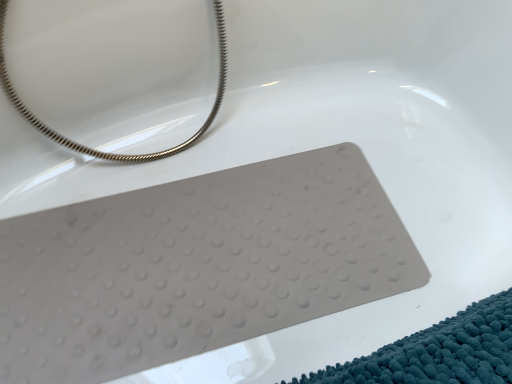
What do you see at coordinates (113, 153) in the screenshot? The width and height of the screenshot is (512, 384). I see `silver metallic chain at upper left` at bounding box center [113, 153].

Find the location of `silver metallic chain at upper left`. silver metallic chain at upper left is located at coordinates point(113,153).

Find the location of a particular element. This screenshot has width=512, height=384. silver metallic chain at upper left is located at coordinates (x=113, y=153).